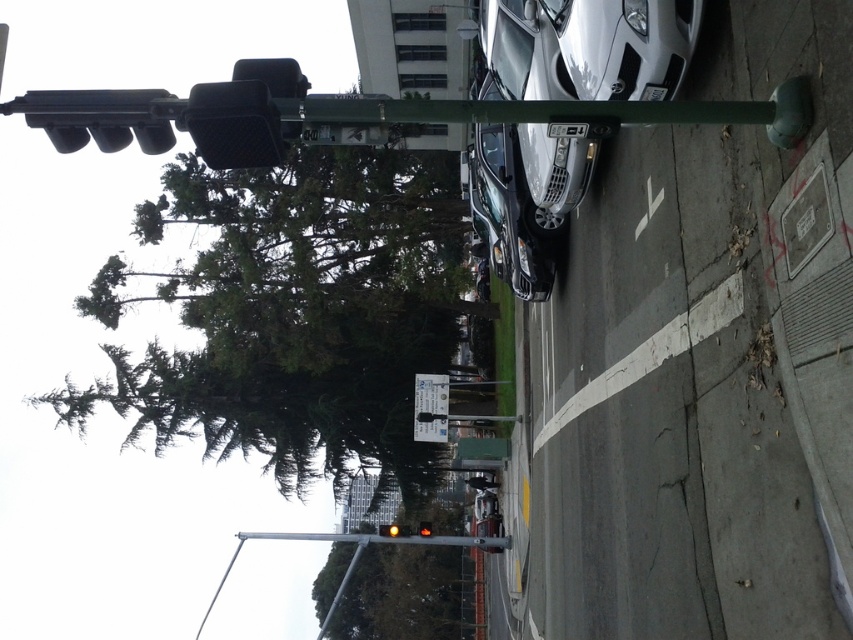
Question: Which of these objects is positioned farthest from the green leafy tree at center?

Choices:
 (A) amber glass traffic light at upper center
 (B) satin silver car at center

Answer: (B)

Question: Does green matte tree at upper left have a larger size compared to yellow glass traffic light at center?

Choices:
 (A) yes
 (B) no

Answer: (A)

Question: Which object is the closest to the white plastic street sign at center?

Choices:
 (A) yellow glass traffic light at center
 (B) amber glass traffic light at upper center
 (C) green leafy tree at center
 (D) satin silver car at center

Answer: (A)

Question: Can you confirm if satin silver car at center is positioned to the right of yellow glass traffic light at center?

Choices:
 (A) no
 (B) yes

Answer: (B)

Question: Which of the following is the farthest from the observer?

Choices:
 (A) (430, 531)
 (B) (395, 531)
 (C) (375, 636)

Answer: (C)

Question: Does green matte tree at upper left have a smaller size compared to yellow glass traffic light at center?

Choices:
 (A) yes
 (B) no

Answer: (B)